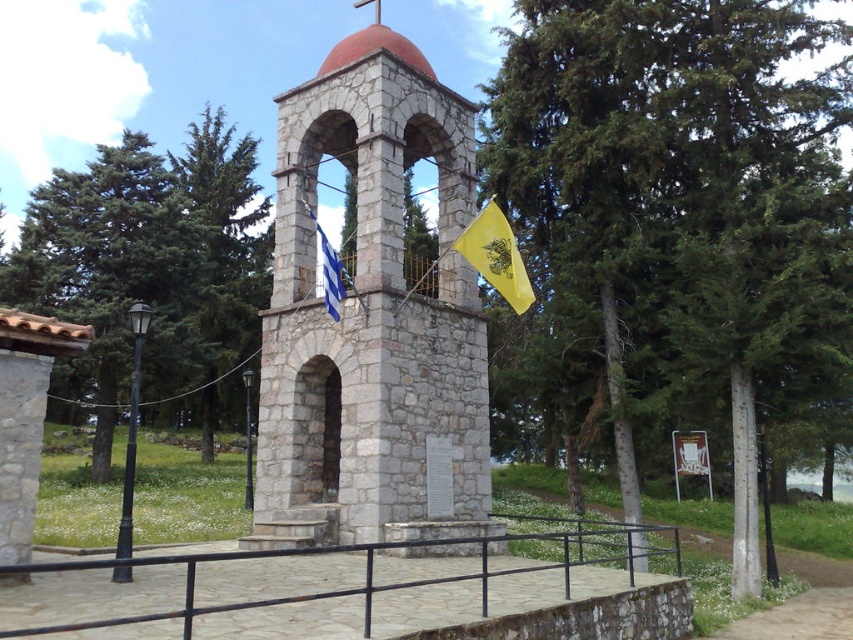
You are a bird flying over a serene outdoor area with a green leafy tree at center and a stone bell tower at center. Which object would you need to fly higher to see the top of?

The green leafy tree at center is much taller than the stone bell tower at center, so you would need to fly higher to see the top of the green leafy tree at center.